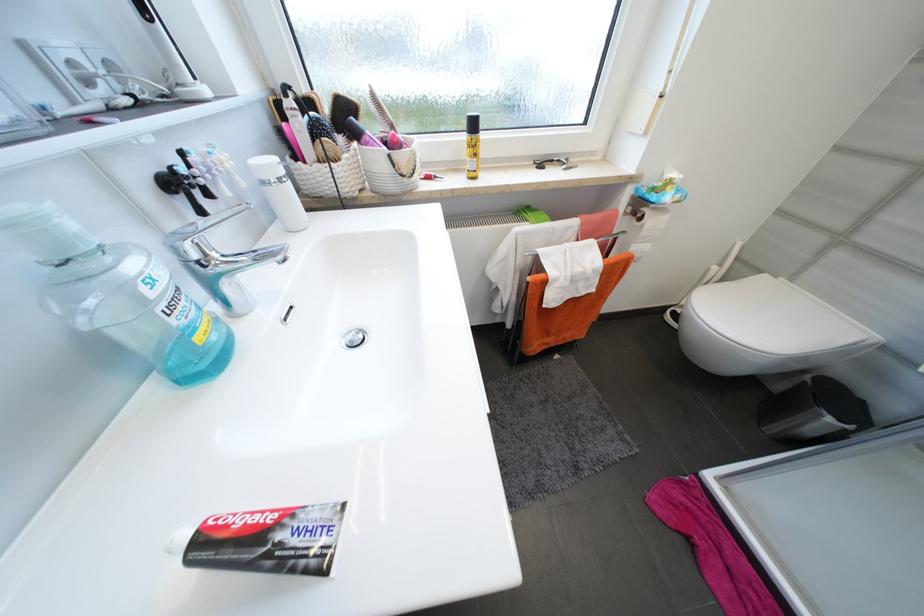
What do you see at coordinates (205, 224) in the screenshot?
I see `the silver faucet handle` at bounding box center [205, 224].